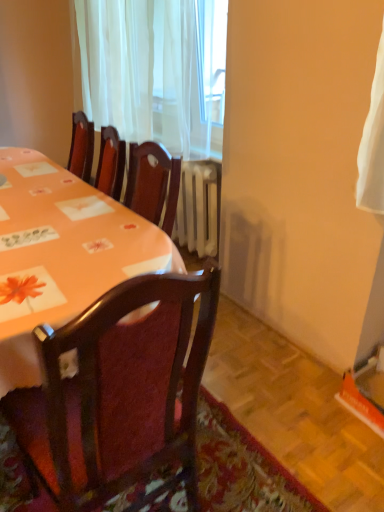
Where is `spots to the right of wooden chair at center`? spots to the right of wooden chair at center is located at coordinates (256, 464).